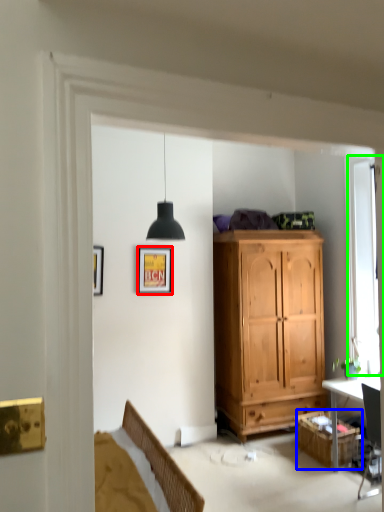
Question: Estimate the real-world distances between objects in this image. Which object is closer to picture frame (highlighted by a red box), cabinetry (highlighted by a blue box) or window (highlighted by a green box)?

Choices:
 (A) cabinetry
 (B) window

Answer: (B)